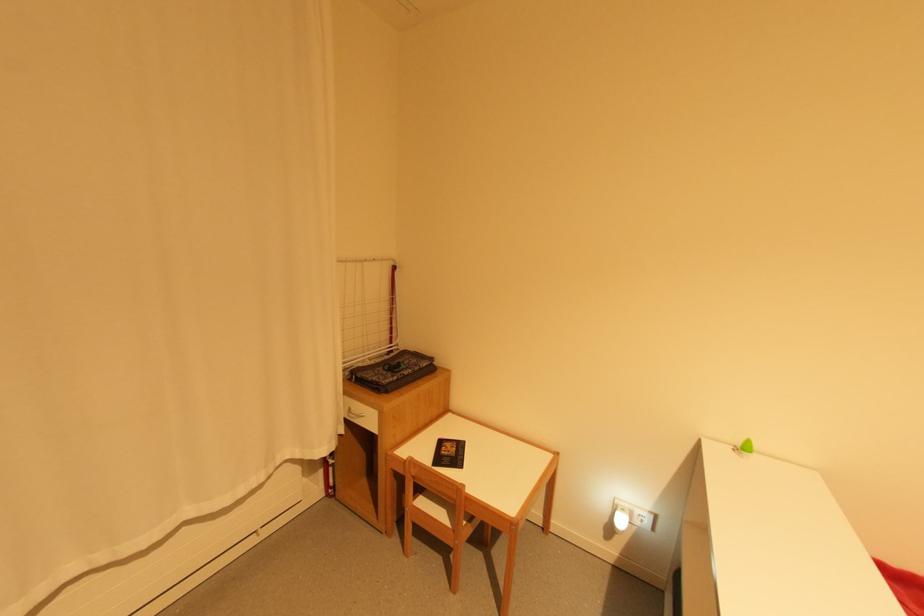
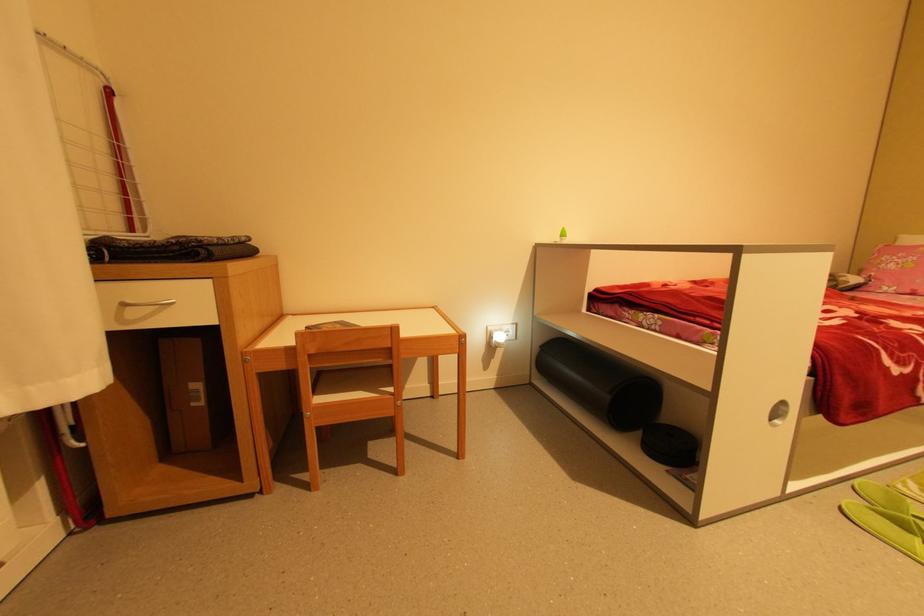
Find the pixel in the second image that matches point 357,408 in the first image.

(134, 302)